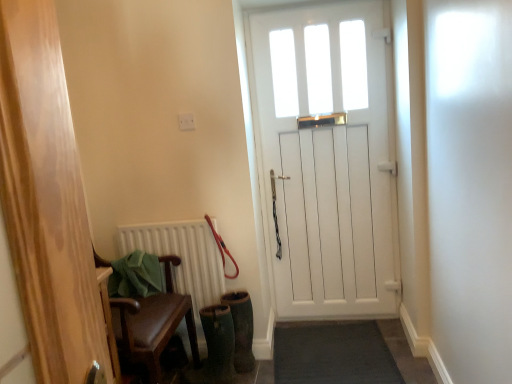
Where is `spots to the right of green suede boot at lower center`? The height and width of the screenshot is (384, 512). spots to the right of green suede boot at lower center is located at coordinates (267, 369).